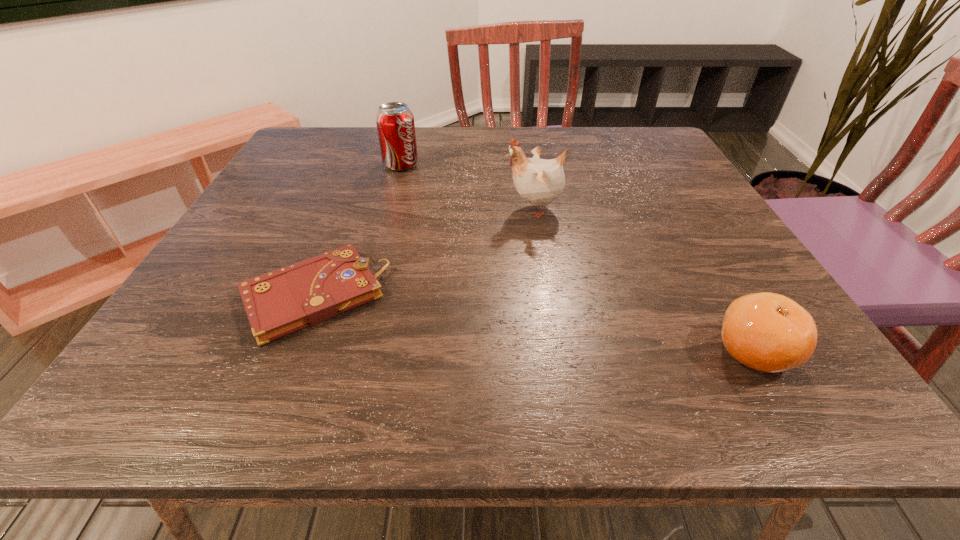
This screenshot has width=960, height=540. I want to click on free spot at the right edge of the desktop, so click(x=692, y=197).

Find the location of `vacant space at the far left corner of the desktop`. vacant space at the far left corner of the desktop is located at coordinates (326, 130).

The image size is (960, 540). In the image, there is a desktop. In order to click on vacant space at the far right corner in this screenshot , I will do `click(655, 143)`.

Where is `free space between the clementine and the third object from left to right`? free space between the clementine and the third object from left to right is located at coordinates (644, 280).

Find the location of a particular element. vacant space in between the notebook and the farthest object is located at coordinates (357, 230).

Find the location of a particular element. free space that is in between the shortest object and the clementine is located at coordinates (533, 323).

Identify the location of unoccupied position between the bird and the farthest object. (468, 187).

What are the coordinates of `free spot between the notebook and the rightmost object` in the screenshot? It's located at (533, 323).

Locate an element on the screen. The image size is (960, 540). free space between the rightmost object and the soda can is located at coordinates (577, 258).

Find the location of `free space between the rightmost object and the notebook`. free space between the rightmost object and the notebook is located at coordinates (533, 323).